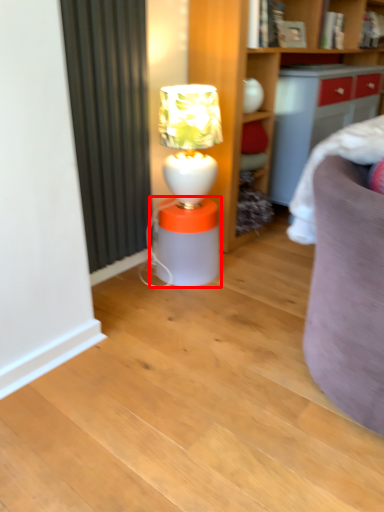
Question: Where is table (annotated by the red box) located in relation to table lamp in the image?

Choices:
 (A) left
 (B) right

Answer: (A)